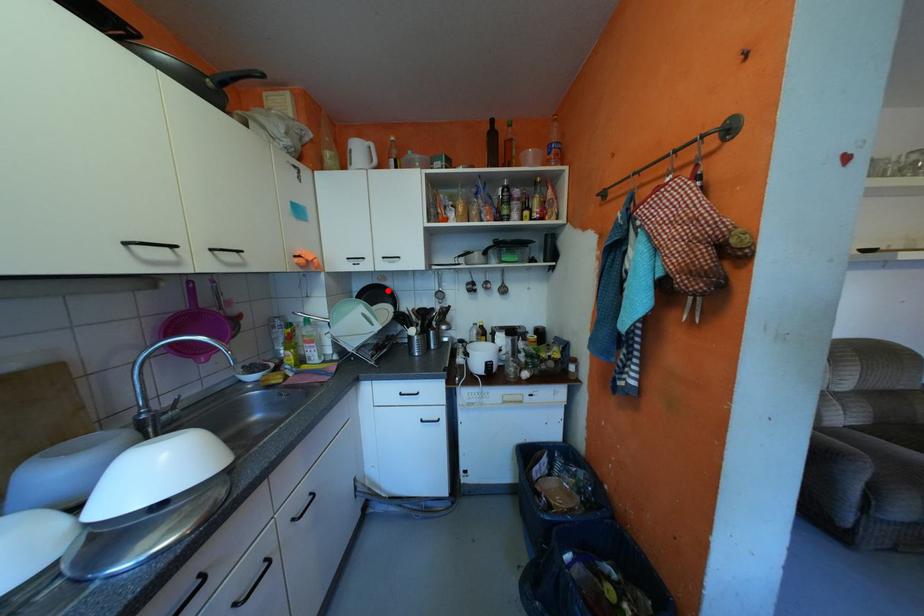
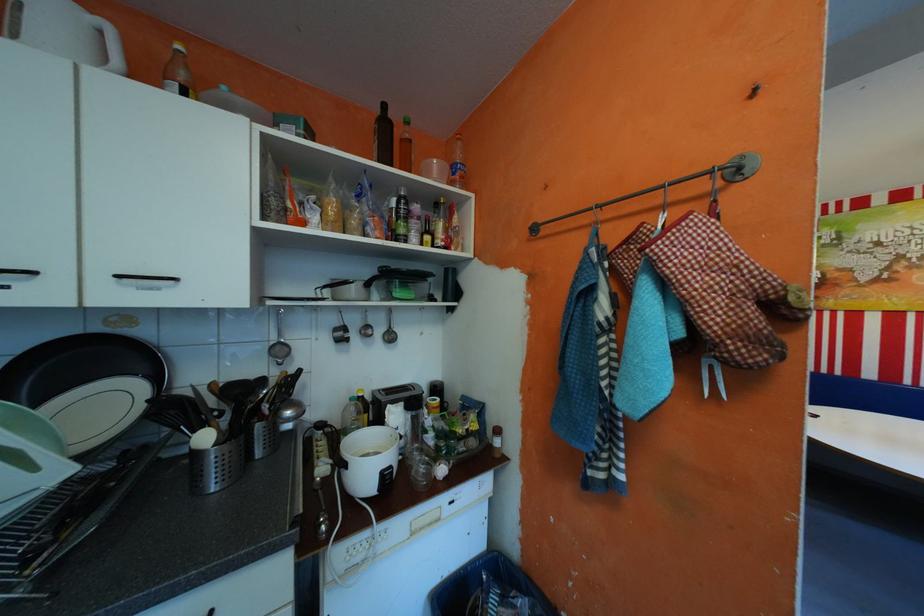
Locate, in the second image, the point that corresponds to the highlighted location in the first image.

(105, 353)